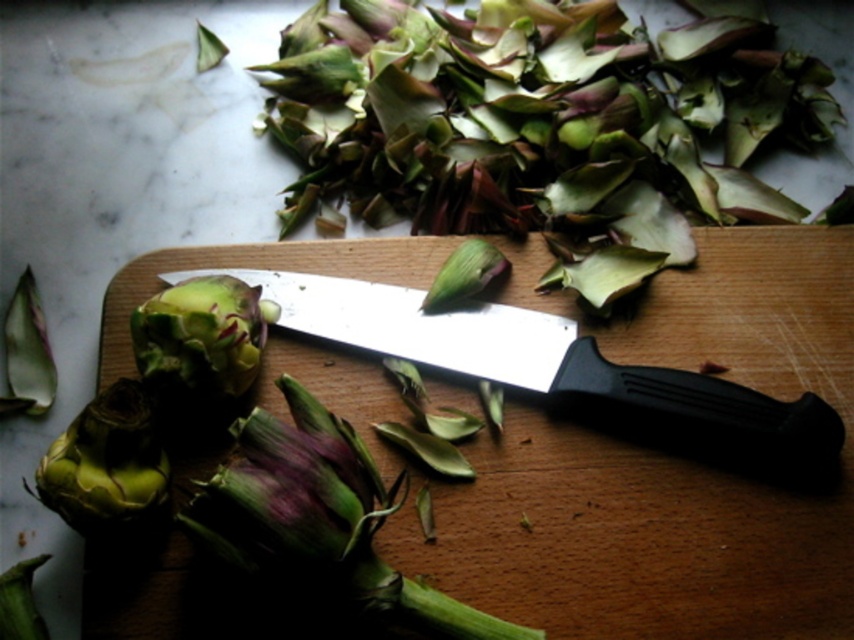
Which of these two, green matte artichoke at lower left or green matte artichoke at center, stands taller?

Standing taller between the two is green matte artichoke at lower left.

Is green matte artichoke at lower left to the right of green matte artichoke at center from the viewer's perspective?

No, green matte artichoke at lower left is not to the right of green matte artichoke at center.

Does point (79, 436) lie behind point (167, 339)?

No, it is not.

Identify the location of green matte artichoke at lower left. This screenshot has width=854, height=640. (104, 461).

Can you confirm if purple matte artichoke at center is thinner than green matte artichoke at lower left?

No, purple matte artichoke at center is not thinner than green matte artichoke at lower left.

Is purple matte artichoke at center to the left of green matte artichoke at lower left from the viewer's perspective?

No, purple matte artichoke at center is not to the left of green matte artichoke at lower left.

Who is more distant from viewer, (361, 493) or (117, 452)?

Point (361, 493)

Identify the location of purple matte artichoke at center. The width and height of the screenshot is (854, 640). (319, 516).

Is purple matte artichoke at center above green matte artichoke at center?

Incorrect, purple matte artichoke at center is not positioned above green matte artichoke at center.

Is purple matte artichoke at center shorter than green matte artichoke at center?

No, purple matte artichoke at center is not shorter than green matte artichoke at center.

Is point (252, 465) positioned behind point (253, 312)?

No, (252, 465) is closer to viewer.

This screenshot has height=640, width=854. Identify the location of purple matte artichoke at center. 319,516.